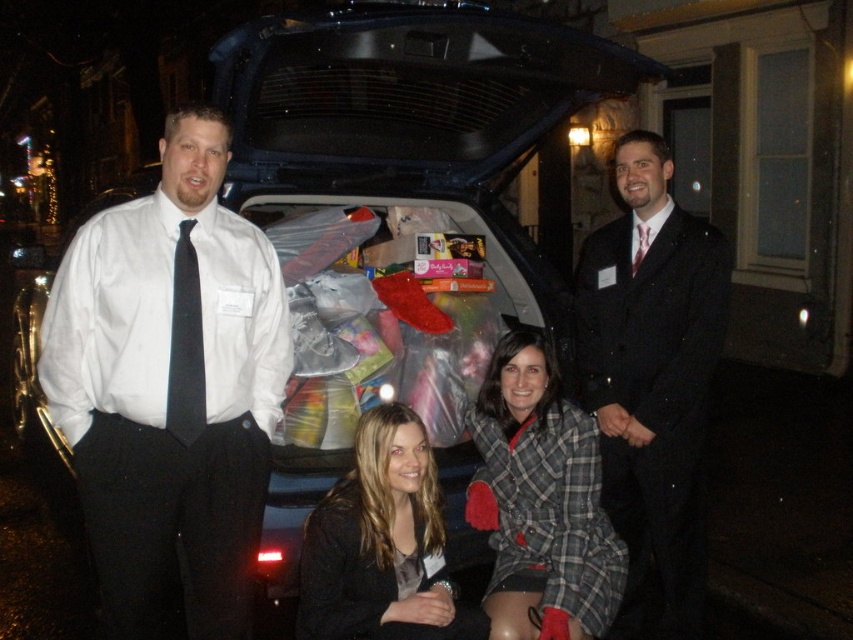
Question: Does dark gray suit at center have a lesser width compared to black silk tie at center?

Choices:
 (A) yes
 (B) no

Answer: (B)

Question: Considering the relative positions of dark gray suit at center and matte black jacket at lower center in the image provided, where is dark gray suit at center located with respect to matte black jacket at lower center?

Choices:
 (A) right
 (B) left

Answer: (A)

Question: Which of these objects is positioned closest to the black satin tie at left?

Choices:
 (A) matte black jacket at lower center
 (B) white shirt at left
 (C) plaid wool coat at lower center

Answer: (B)

Question: Observing the image, what is the correct spatial positioning of white shirt at left in reference to plaid wool coat at lower center?

Choices:
 (A) left
 (B) right

Answer: (A)

Question: Which point appears farthest from the camera in this image?

Choices:
 (A) (639, 230)
 (B) (190, 387)
 (C) (550, 378)

Answer: (A)

Question: Among these objects, which one is farthest from the camera?

Choices:
 (A) black satin tie at left
 (B) dark gray suit at center

Answer: (B)